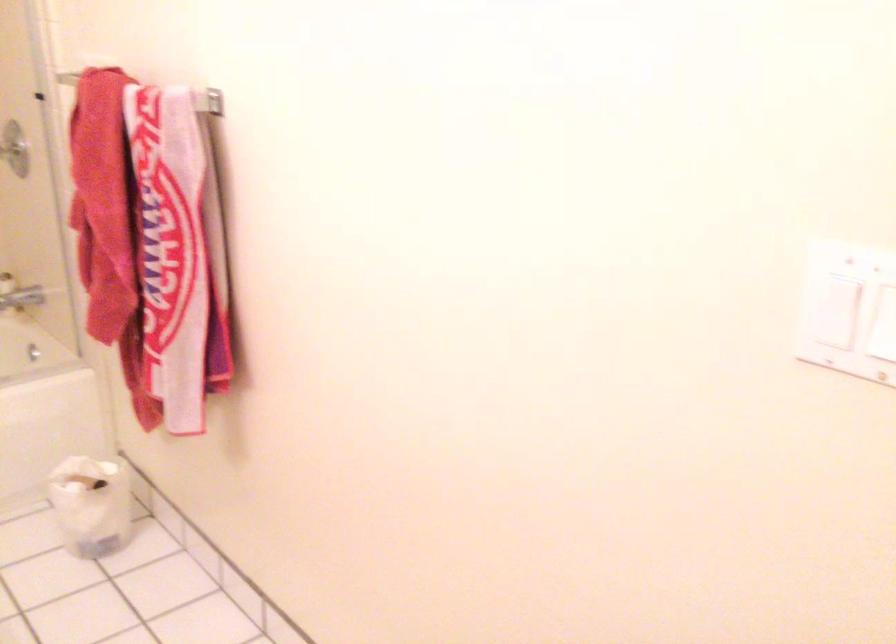
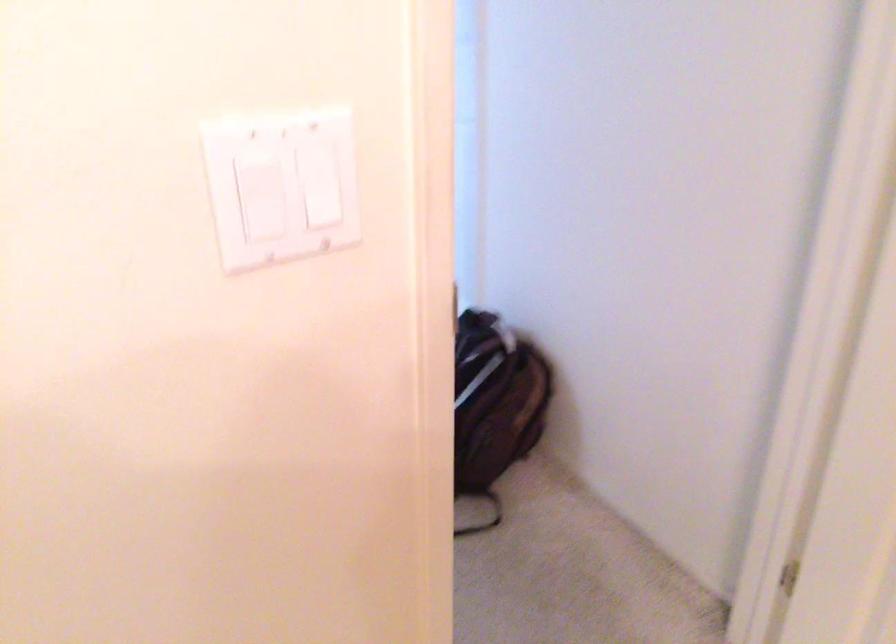
How did the camera likely rotate?

The camera's rotation is toward right-down.